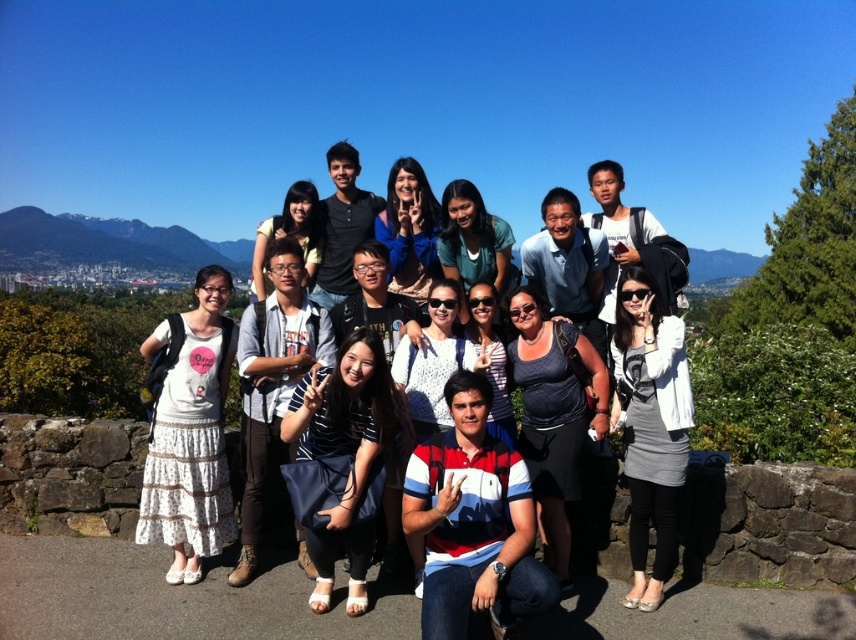
Who is taller, gray fabric dress at center or dark gray fabric dress at center?

Standing taller between the two is gray fabric dress at center.

The height and width of the screenshot is (640, 856). What do you see at coordinates (651, 426) in the screenshot?
I see `gray fabric dress at center` at bounding box center [651, 426].

Who is more forward, (619, 284) or (571, 365)?

A: Point (619, 284) is more forward.

At what (x,y) coordinates should I click in order to perform the action: click on gray fabric dress at center. Please return your answer as a coordinate pair (x, y). The height and width of the screenshot is (640, 856). Looking at the image, I should click on (651, 426).

Who is positioned more to the right, gray fabric dress at center or matte gray backpack at center?

gray fabric dress at center

Can you confirm if gray fabric dress at center is bigger than matte gray backpack at center?

Incorrect, gray fabric dress at center is not larger than matte gray backpack at center.

Find the location of a particular element. gray fabric dress at center is located at coordinates (651, 426).

Who is lower down, striped cotton polo shirt at center or dark gray fabric dress at center?

striped cotton polo shirt at center is below.

Looking at this image, does striped cotton polo shirt at center come behind dark gray fabric dress at center?

No, striped cotton polo shirt at center is closer to the viewer.

Between point (419, 516) and point (575, 388), which one is positioned behind?

Positioned behind is point (575, 388).

The width and height of the screenshot is (856, 640). In order to click on striped cotton polo shirt at center in this screenshot , I will do `click(473, 522)`.